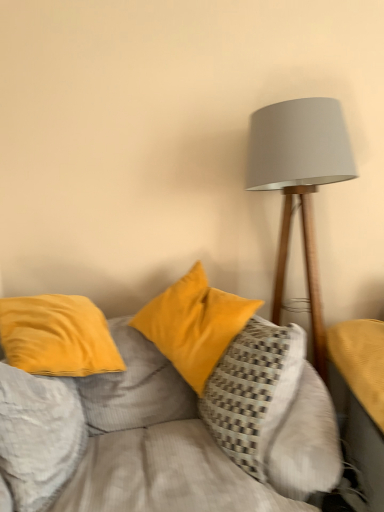
Question: From the image's perspective, is matte gray lampshade at right over yellow fabric table at right?

Choices:
 (A) no
 (B) yes

Answer: (B)

Question: Is matte gray lampshade at right at the right side of yellow fabric table at right?

Choices:
 (A) yes
 (B) no

Answer: (B)

Question: Considering the relative positions of matte gray lampshade at right and yellow fabric table at right in the image provided, is matte gray lampshade at right in front of yellow fabric table at right?

Choices:
 (A) yes
 (B) no

Answer: (B)

Question: Is matte gray lampshade at right positioned beyond the bounds of yellow fabric table at right?

Choices:
 (A) yes
 (B) no

Answer: (A)

Question: Is matte gray lampshade at right thinner than yellow fabric table at right?

Choices:
 (A) no
 (B) yes

Answer: (B)

Question: From the image's perspective, is velvet yellow pillow at left, acting as the first pillow starting from the left, above or below velvet yellow pillows at center?

Choices:
 (A) below
 (B) above

Answer: (B)

Question: Is velvet yellow pillow at left, acting as the first pillow starting from the left, to the left or to the right of velvet yellow pillows at center in the image?

Choices:
 (A) right
 (B) left

Answer: (B)

Question: In the image, is velvet yellow pillow at left, the third pillow from the right, positioned in front of or behind velvet yellow pillows at center?

Choices:
 (A) front
 (B) behind

Answer: (B)

Question: In terms of height, does velvet yellow pillow at left, acting as the first pillow starting from the left, look taller or shorter compared to velvet yellow pillows at center?

Choices:
 (A) tall
 (B) short

Answer: (B)

Question: Considering the positions of velvet yellow pillow at center, which is the first pillow in right-to-left order, and velvet yellow pillow at left, acting as the first pillow starting from the left, in the image, is velvet yellow pillow at center, which is the first pillow in right-to-left order, taller or shorter than velvet yellow pillow at left, acting as the first pillow starting from the left,?

Choices:
 (A) tall
 (B) short

Answer: (A)

Question: Which is correct: velvet yellow pillow at center, positioned as the 3th pillow in left-to-right order, is inside velvet yellow pillow at left, the third pillow from the right, or outside of it?

Choices:
 (A) outside
 (B) inside

Answer: (A)

Question: From the image's perspective, is velvet yellow pillow at center, which is the first pillow in right-to-left order, above or below velvet yellow pillow at left, acting as the first pillow starting from the left?

Choices:
 (A) above
 (B) below

Answer: (A)

Question: Considering the positions of velvet yellow pillow at center, positioned as the 3th pillow in left-to-right order, and velvet yellow pillow at left, the third pillow from the right, in the image, is velvet yellow pillow at center, positioned as the 3th pillow in left-to-right order, bigger or smaller than velvet yellow pillow at left, the third pillow from the right,?

Choices:
 (A) small
 (B) big

Answer: (B)

Question: Considering the positions of velvet yellow pillow at center, positioned as the 3th pillow in left-to-right order, and velvet yellow pillows at center in the image, is velvet yellow pillow at center, positioned as the 3th pillow in left-to-right order, taller or shorter than velvet yellow pillows at center?

Choices:
 (A) tall
 (B) short

Answer: (B)

Question: Is velvet yellow pillow at center, which is the first pillow in right-to-left order, situated inside velvet yellow pillows at center or outside?

Choices:
 (A) outside
 (B) inside

Answer: (B)